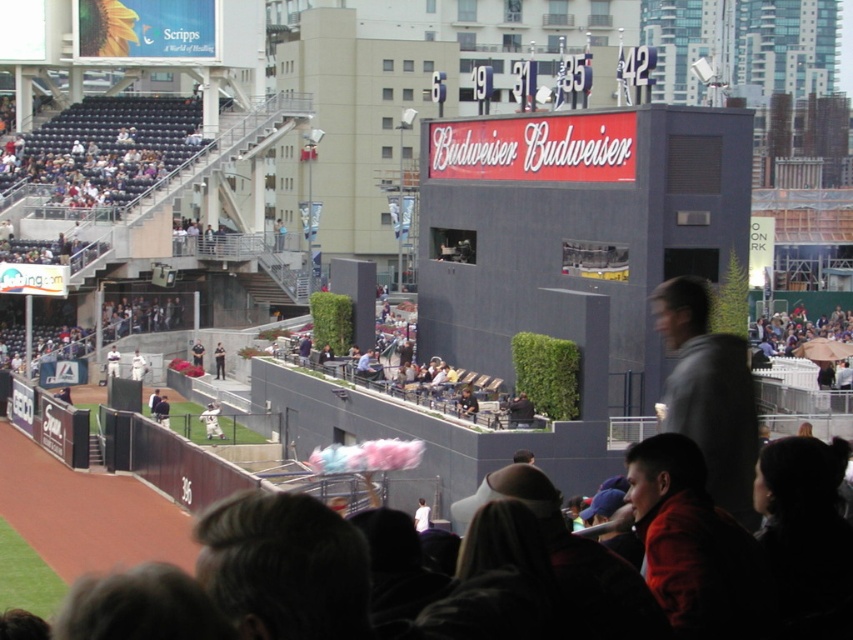
Question: Which of the following is the farthest from the observer?

Choices:
 (A) white cotton candy at center
 (B) white baseball glove at center
 (C) white baseball uniform at center
 (D) white jersey at center

Answer: (A)

Question: Is white baseball uniform at center bigger than white cotton candy at center?

Choices:
 (A) yes
 (B) no

Answer: (A)

Question: Which object is the farthest from the white cotton candy at center?

Choices:
 (A) white jersey at center
 (B) white baseball uniform at center

Answer: (A)

Question: Can you confirm if white baseball uniform at center is smaller than white cotton candy at center?

Choices:
 (A) yes
 (B) no

Answer: (B)

Question: Is white jersey at center smaller than white cotton candy at center?

Choices:
 (A) yes
 (B) no

Answer: (A)

Question: Which point is farther from the camera taking this photo?

Choices:
 (A) (210, 428)
 (B) (109, 355)

Answer: (B)